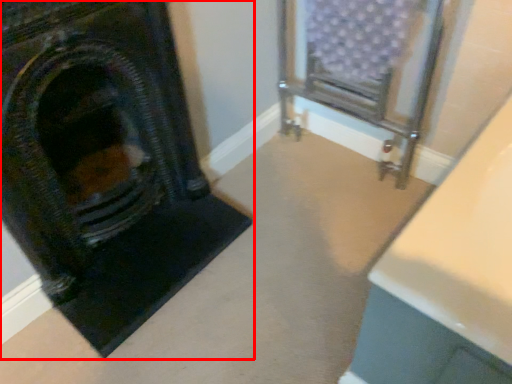
Question: From the image's perspective, where is fireplace (annotated by the red box) located in relation to furniture in the image?

Choices:
 (A) above
 (B) below

Answer: (B)